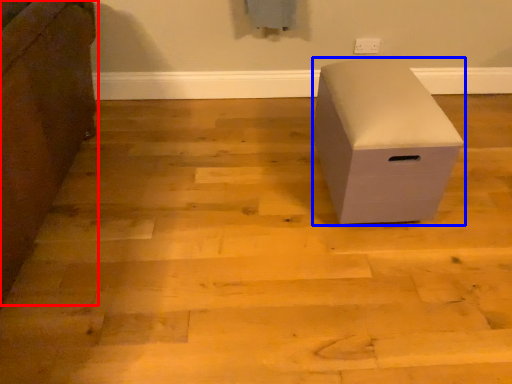
Question: Which point is further to the camera, furniture (highlighted by a red box) or furniture (highlighted by a blue box)?

Choices:
 (A) furniture
 (B) furniture

Answer: (B)